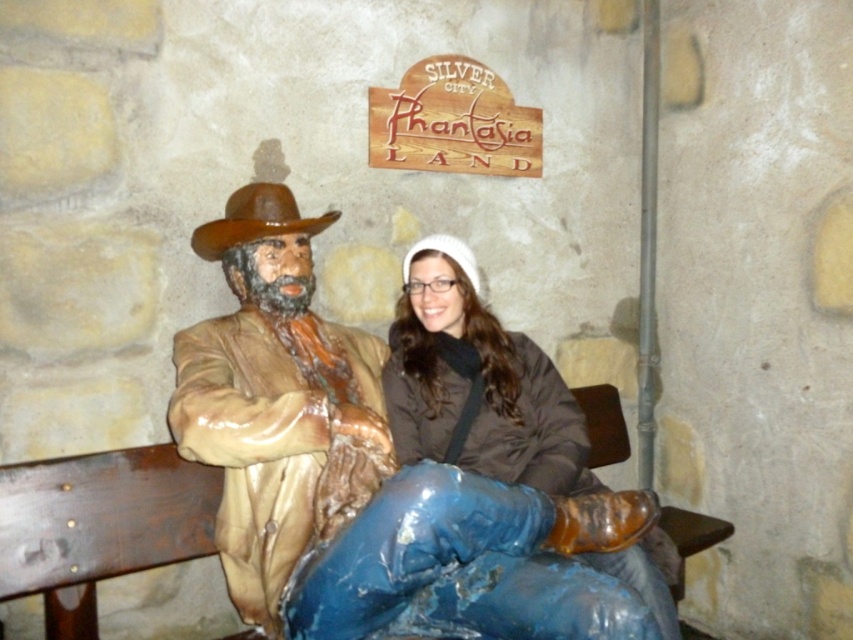
Can you confirm if matte brown statue at left is positioned below matte brown jacket at center?

Incorrect, matte brown statue at left is not positioned below matte brown jacket at center.

Does matte brown statue at left come in front of matte brown jacket at center?

No, matte brown statue at left is further to the viewer.

Locate an element on the screen. The height and width of the screenshot is (640, 853). matte brown statue at left is located at coordinates (276, 401).

Can you confirm if matte brown jacket at center is positioned to the left of brown glossy cowboy hat at left?

Incorrect, matte brown jacket at center is not on the left side of brown glossy cowboy hat at left.

Consider the image. Is matte brown jacket at center bigger than brown glossy cowboy hat at left?

Yes.

Is point (453, 280) farther from viewer compared to point (233, 212)?

Yes, point (453, 280) is farther from viewer.

Locate an element on the screen. This screenshot has width=853, height=640. matte brown jacket at center is located at coordinates (477, 384).

Does matte brown statue at left appear on the right side of brown glossy cowboy hat at left?

Correct, you'll find matte brown statue at left to the right of brown glossy cowboy hat at left.

Based on the photo, is matte brown statue at left positioned at the back of brown glossy cowboy hat at left?

No.

Between point (297, 552) and point (276, 209), which one is positioned in front?

Positioned in front is point (297, 552).

Where is `matte brown statue at left`? The width and height of the screenshot is (853, 640). matte brown statue at left is located at coordinates (276, 401).